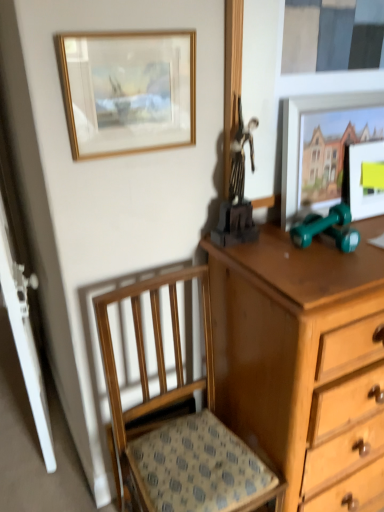
Question: Is green rubber dumbbells at right, the second toy from the left, further to camera compared to shiny black statue at upper center, which is counted as the second toy, starting from the right?

Choices:
 (A) no
 (B) yes

Answer: (B)

Question: Is green rubber dumbbells at right, the second toy from the left, closer to camera compared to shiny black statue at upper center, arranged as the 1th toy when viewed from the left?

Choices:
 (A) yes
 (B) no

Answer: (B)

Question: Can you confirm if green rubber dumbbells at right, the second toy from the left, is positioned to the left of shiny black statue at upper center, arranged as the 1th toy when viewed from the left?

Choices:
 (A) no
 (B) yes

Answer: (A)

Question: From a real-world perspective, is green rubber dumbbells at right, the first toy viewed from the right, positioned over shiny black statue at upper center, arranged as the 1th toy when viewed from the left, based on gravity?

Choices:
 (A) no
 (B) yes

Answer: (A)

Question: Is shiny black statue at upper center, which is counted as the second toy, starting from the right, inside green rubber dumbbells at right, the second toy from the left?

Choices:
 (A) yes
 (B) no

Answer: (B)

Question: Does green rubber dumbbells at right, the second toy from the left, have a lesser height compared to shiny black statue at upper center, arranged as the 1th toy when viewed from the left?

Choices:
 (A) no
 (B) yes

Answer: (B)

Question: From a real-world perspective, is gold-framed painting at upper left, acting as the first picture frame starting from the left, under shiny black statue at upper center, arranged as the 1th toy when viewed from the left?

Choices:
 (A) no
 (B) yes

Answer: (A)

Question: Could you tell me if gold-framed painting at upper left, the 3th picture frame viewed from the right, is facing shiny black statue at upper center, which is counted as the second toy, starting from the right?

Choices:
 (A) yes
 (B) no

Answer: (B)

Question: Does gold-framed painting at upper left, the 3th picture frame viewed from the right, have a larger size compared to shiny black statue at upper center, which is counted as the second toy, starting from the right?

Choices:
 (A) no
 (B) yes

Answer: (A)

Question: Is shiny black statue at upper center, arranged as the 1th toy when viewed from the left, located within gold-framed painting at upper left, acting as the first picture frame starting from the left?

Choices:
 (A) yes
 (B) no

Answer: (B)

Question: Does gold-framed painting at upper left, the 3th picture frame viewed from the right, have a lesser width compared to shiny black statue at upper center, which is counted as the second toy, starting from the right?

Choices:
 (A) yes
 (B) no

Answer: (A)

Question: Is gold-framed painting at upper left, the 3th picture frame viewed from the right, far from shiny black statue at upper center, which is counted as the second toy, starting from the right?

Choices:
 (A) yes
 (B) no

Answer: (B)

Question: Is shiny black statue at upper center, arranged as the 1th toy when viewed from the left, positioned in front of gold-framed painting at upper left, acting as the first picture frame starting from the left?

Choices:
 (A) yes
 (B) no

Answer: (B)